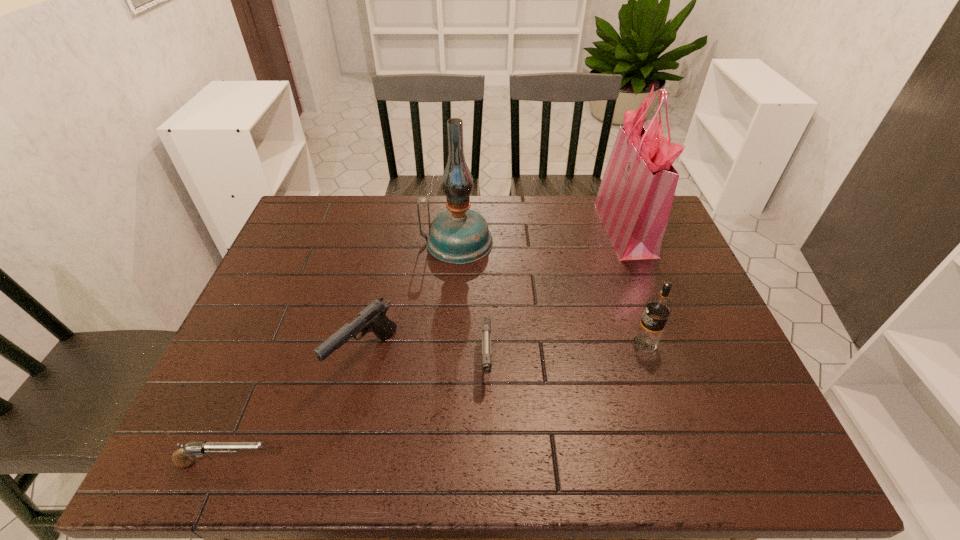
Locate an element on the screen. shopping bag is located at coordinates (634, 201).

Image resolution: width=960 pixels, height=540 pixels. What are the coordinates of `oil lamp` in the screenshot? It's located at (459, 235).

Locate an element on the screen. the third tallest object is located at coordinates pos(658,308).

Where is `the second gun from right to left`? The width and height of the screenshot is (960, 540). the second gun from right to left is located at coordinates (373, 318).

Find the location of a particular element. The height and width of the screenshot is (540, 960). the second object from left to right is located at coordinates (373, 318).

Identify the location of the fifth tallest object. (486, 321).

Find the location of a particular element. This screenshot has height=540, width=960. the second shortest gun is located at coordinates (486, 321).

Identify the location of the leftmost object. The height and width of the screenshot is (540, 960). (181, 458).

Identify the location of the shortest object. tap(181, 458).

I want to click on vacant region located 0.120m on the front of the shopping bag, so click(x=648, y=289).